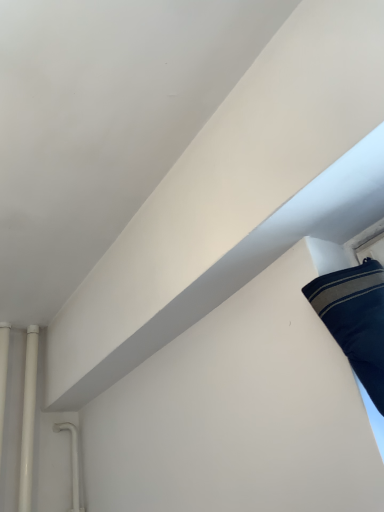
Question: Based on their sizes in the image, would you say white glossy pipe at left, the second pipe when ordered from left to right, is bigger or smaller than white glossy pipe at left, marked as the first pipe in a left-to-right arrangement?

Choices:
 (A) big
 (B) small

Answer: (A)

Question: From the image's perspective, is white glossy pipe at left, marked as the first pipe in a right-to-left arrangement, positioned above or below white glossy pipe at left, marked as the first pipe in a left-to-right arrangement?

Choices:
 (A) below
 (B) above

Answer: (A)

Question: Is white glossy pipe at left, the second pipe when ordered from left to right, wider or thinner than white glossy pipe at left, marked as the first pipe in a left-to-right arrangement?

Choices:
 (A) thin
 (B) wide

Answer: (B)

Question: Choose the correct answer: Is white glossy pipe at left, the second pipe from the right, inside white glossy pipe at left, the second pipe when ordered from left to right, or outside it?

Choices:
 (A) inside
 (B) outside

Answer: (B)

Question: From the image's perspective, is white glossy pipe at left, marked as the first pipe in a left-to-right arrangement, positioned above or below white glossy pipe at left, marked as the first pipe in a right-to-left arrangement?

Choices:
 (A) above
 (B) below

Answer: (A)

Question: From a real-world perspective, is white glossy pipe at left, the second pipe from the right, above or below white glossy pipe at left, the second pipe when ordered from left to right?

Choices:
 (A) below
 (B) above

Answer: (B)

Question: In terms of height, does white glossy pipe at left, marked as the first pipe in a left-to-right arrangement, look taller or shorter compared to white glossy pipe at left, marked as the first pipe in a right-to-left arrangement?

Choices:
 (A) tall
 (B) short

Answer: (B)